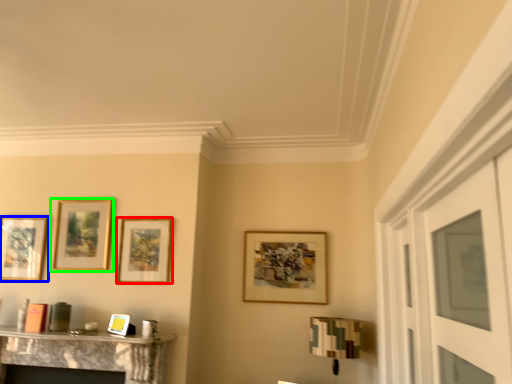
Question: Based on their relative distances, which object is farther from picture frame (highlighted by a red box)? Choose from picture frame (highlighted by a blue box) and picture frame (highlighted by a green box).

Choices:
 (A) picture frame
 (B) picture frame

Answer: (A)